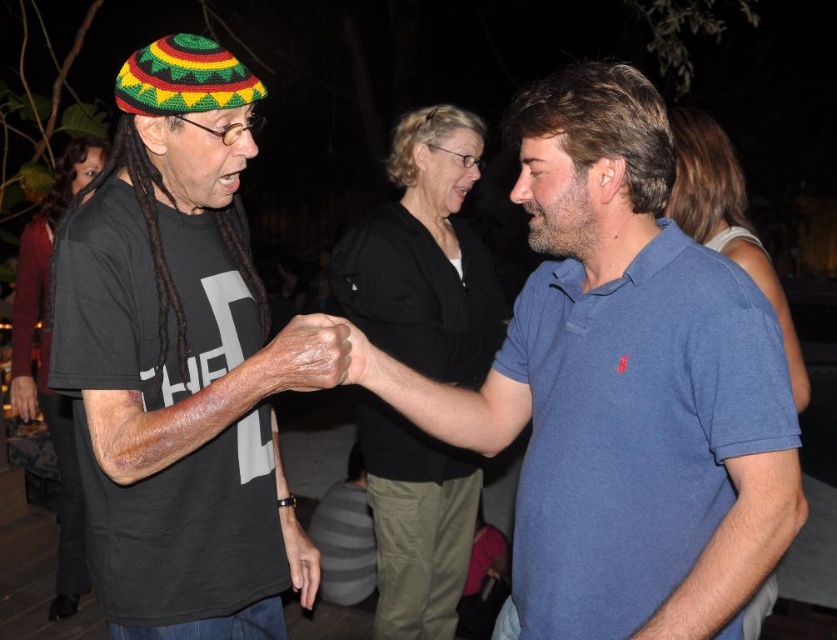
Between black matte t-shirt at left and leather-like skin at center, which one is positioned higher?

leather-like skin at center

Is point (168, 276) positioned behind point (362, 342)?

No, it is not.

Image resolution: width=837 pixels, height=640 pixels. I want to click on black matte t-shirt at left, so click(x=175, y=364).

Does black matte t-shirt at left appear under dry skin at center?

Yes.

Does black matte t-shirt at left have a lesser height compared to dry skin at center?

No, black matte t-shirt at left is not shorter than dry skin at center.

At what (x,y) coordinates should I click in order to perform the action: click on black matte t-shirt at left. Please return your answer as a coordinate pair (x, y). This screenshot has width=837, height=640. Looking at the image, I should click on (175, 364).

Where is `black matte t-shirt at left`? The width and height of the screenshot is (837, 640). black matte t-shirt at left is located at coordinates (175, 364).

Which is more to the right, blue cotton polo shirt at center or dry skin at center?

From the viewer's perspective, blue cotton polo shirt at center appears more on the right side.

This screenshot has width=837, height=640. What are the coordinates of `blue cotton polo shirt at center` in the screenshot? It's located at (625, 387).